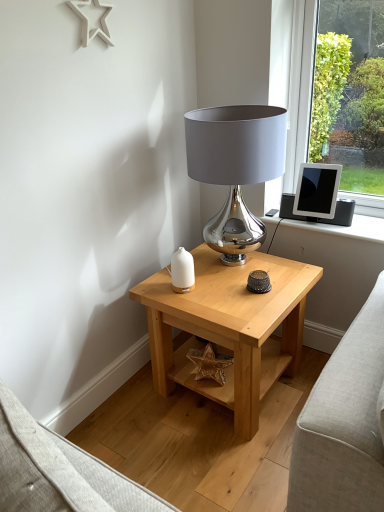
Where is `free space in front of shiny metallic lamp at upper center`? free space in front of shiny metallic lamp at upper center is located at coordinates (236, 300).